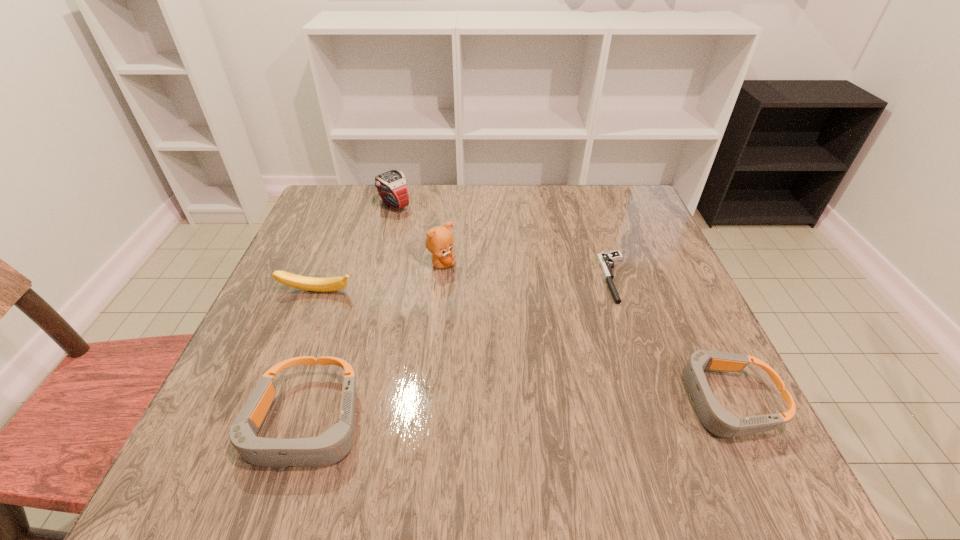
Where is `goggles that is at the left edge`? goggles that is at the left edge is located at coordinates (331, 446).

This screenshot has width=960, height=540. I want to click on banana that is positioned at the left edge, so click(x=329, y=284).

Locate an element on the screen. Image resolution: width=960 pixels, height=540 pixels. goggles that is at the right edge is located at coordinates (719, 421).

Find the location of a particular element. The height and width of the screenshot is (540, 960). pistol that is positioned at the right edge is located at coordinates (605, 259).

Where is `object at the near left corner`? object at the near left corner is located at coordinates coord(331,446).

Identify the location of object that is positioned at the near right corner. (719, 421).

Identify the location of vacant space at the far edge of the desktop. (478, 212).

I want to click on vacant space at the near edge, so click(x=316, y=422).

Locate an element on the screen. The height and width of the screenshot is (540, 960). free space at the left edge of the desktop is located at coordinates (320, 329).

You are a GUI agent. You are given a task and a screenshot of the screen. Output one action in this format:
    pyautogui.click(x=<x>, y=<y>)
    Task: Click on the free spot at the right edge of the desktop
    
    Given the screenshot: What is the action you would take?
    pyautogui.click(x=631, y=252)